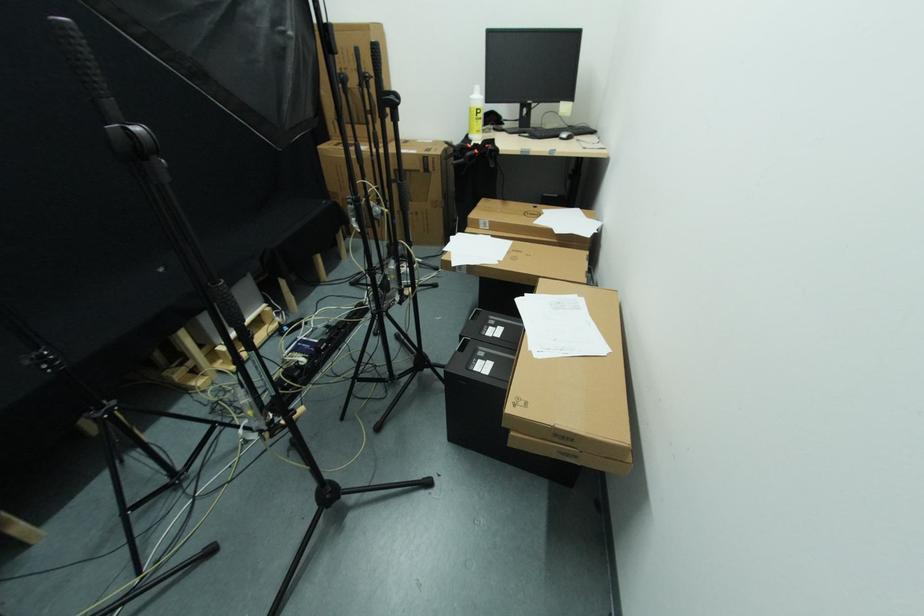
Find where to lift the white bottle. Please return your answer as a coordinate pair (x, y).

(475, 115)